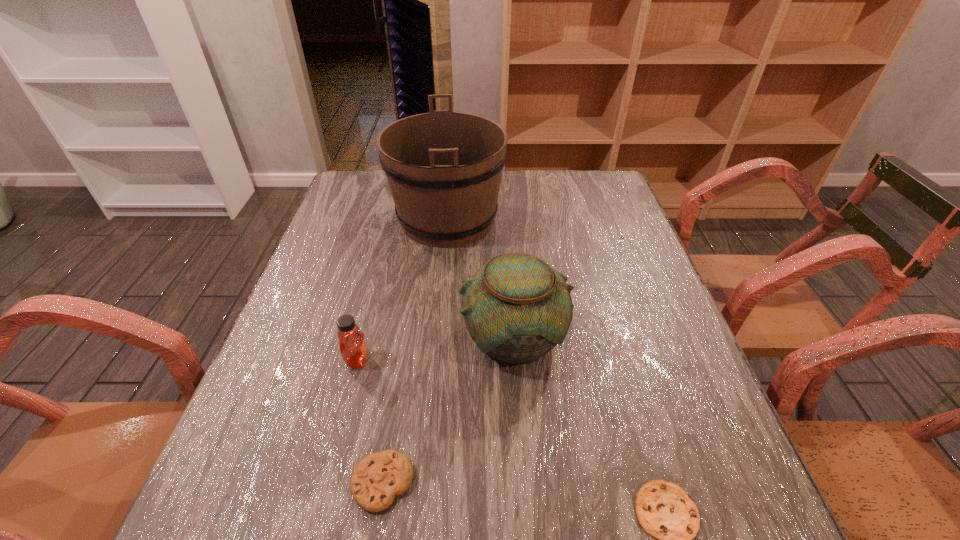
Locate an element on the screen. The width and height of the screenshot is (960, 540). free location that satisfies the following two spatial constraints: 1. on the back side of the taller cookie; 2. on the right side of the bucket is located at coordinates (425, 219).